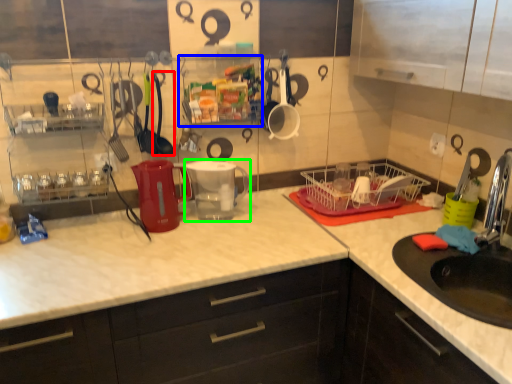
Question: Which object is the closest to the tableware (highlighted by a red box)? Choose among these: shelf (highlighted by a blue box) or appliance (highlighted by a green box).

Choices:
 (A) shelf
 (B) appliance

Answer: (B)